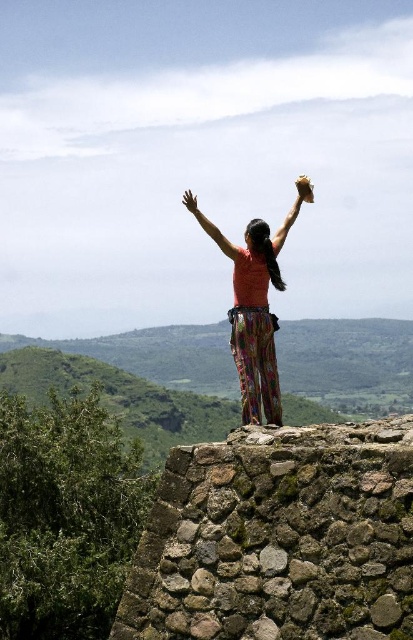
Who is positioned more to the left, matte orange shirt at center or matte brown glove at upper center?

Positioned to the left is matte orange shirt at center.

Between matte orange shirt at center and matte brown glove at upper center, which one has less height?

matte orange shirt at center

The width and height of the screenshot is (413, 640). Identify the location of matte orange shirt at center. (254, 314).

Where is `matte orange shirt at center`? Image resolution: width=413 pixels, height=640 pixels. matte orange shirt at center is located at coordinates click(254, 314).

Does matte orange shirt at center appear over matte skin hand at upper center?

No.

Which is in front, point (272, 314) or point (192, 209)?

Point (272, 314)

Describe the element at coordinates (254, 314) in the screenshot. I see `matte orange shirt at center` at that location.

Find the location of a particular element. matte orange shirt at center is located at coordinates (254, 314).

Is point (367, 481) in front of point (296, 198)?

Yes, point (367, 481) is closer to viewer.

Which is in front, point (211, 508) or point (296, 182)?

Point (211, 508) is in front.

Who is more distant from viewer, (296,435) or (287,227)?

Point (287,227)

Find the location of a particular element. The image size is (413, 640). rustic stone wall at center is located at coordinates (279, 538).